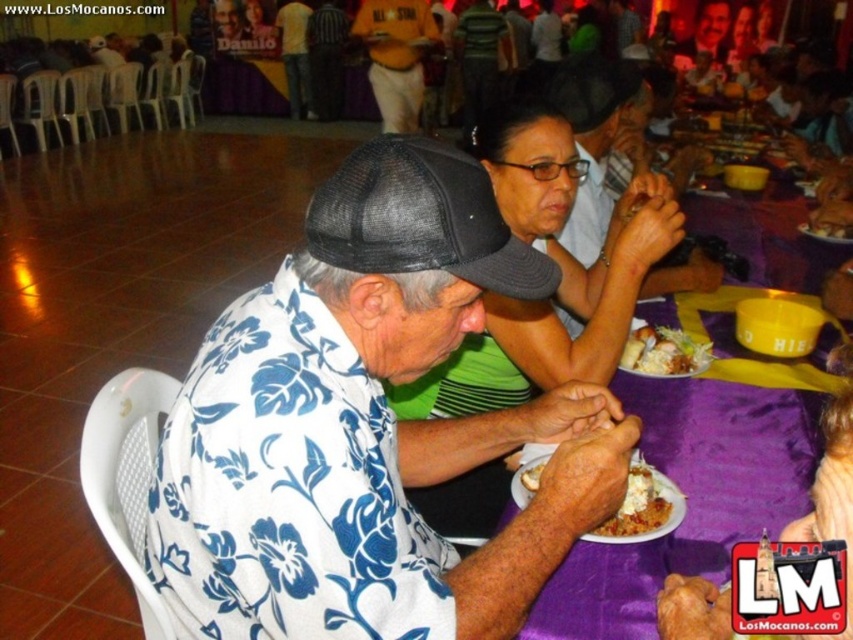
Is white floral shirt at center to the right of black mesh baseball cap at center from the viewer's perspective?

Incorrect, white floral shirt at center is not on the right side of black mesh baseball cap at center.

Is white floral shirt at center to the left of black mesh baseball cap at center from the viewer's perspective?

Yes, white floral shirt at center is to the left of black mesh baseball cap at center.

Who is more distant from viewer, (x=322, y=412) or (x=374, y=182)?

The point (x=374, y=182) is behind.

Locate an element on the screen. The height and width of the screenshot is (640, 853). white floral shirt at center is located at coordinates (366, 426).

Is white floral shirt at center shorter than matte black cap at upper center?

Correct, white floral shirt at center is not as tall as matte black cap at upper center.

Is white floral shirt at center smaller than matte black cap at upper center?

Correct, white floral shirt at center occupies less space than matte black cap at upper center.

Does point (239, 428) lie in front of point (407, 51)?

Yes, point (239, 428) is closer to viewer.

Locate an element on the screen. white floral shirt at center is located at coordinates (366, 426).

Is point (601, 570) farther from camera compared to point (383, 88)?

No, (601, 570) is in front of (383, 88).

Is purple fabric table at center positioned behind matte black cap at upper center?

No, purple fabric table at center is closer to the viewer.

Locate an element on the screen. purple fabric table at center is located at coordinates (700, 467).